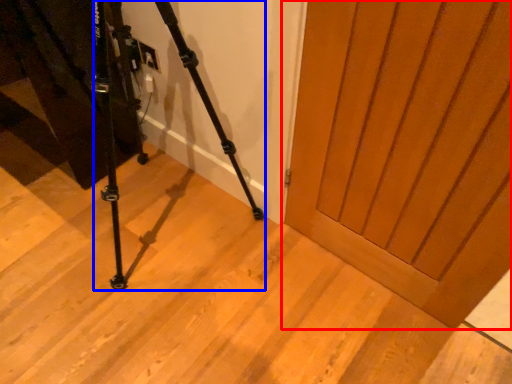
Question: Among these objects, which one is nearest to the camera, door (highlighted by a red box) or tripod (highlighted by a blue box)?

Choices:
 (A) door
 (B) tripod

Answer: (B)